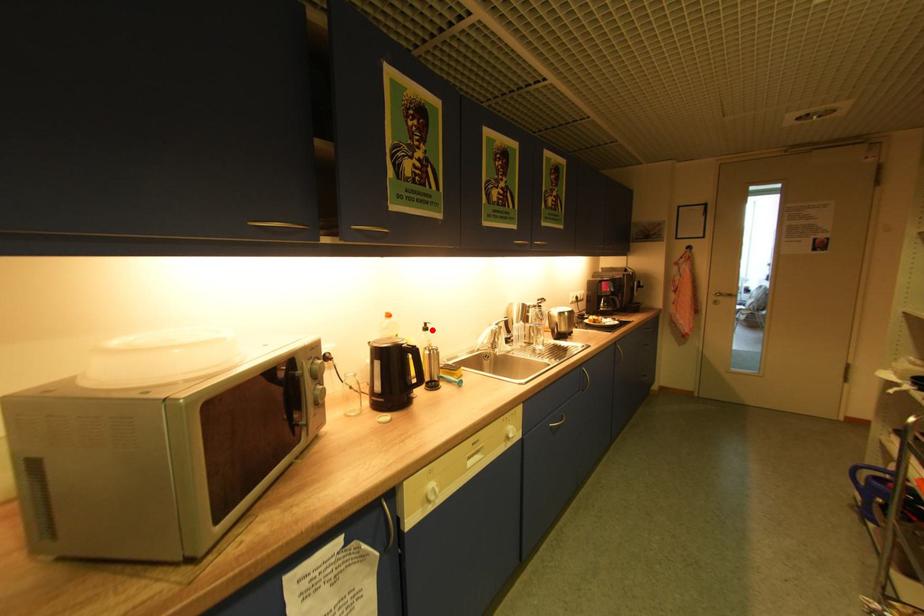
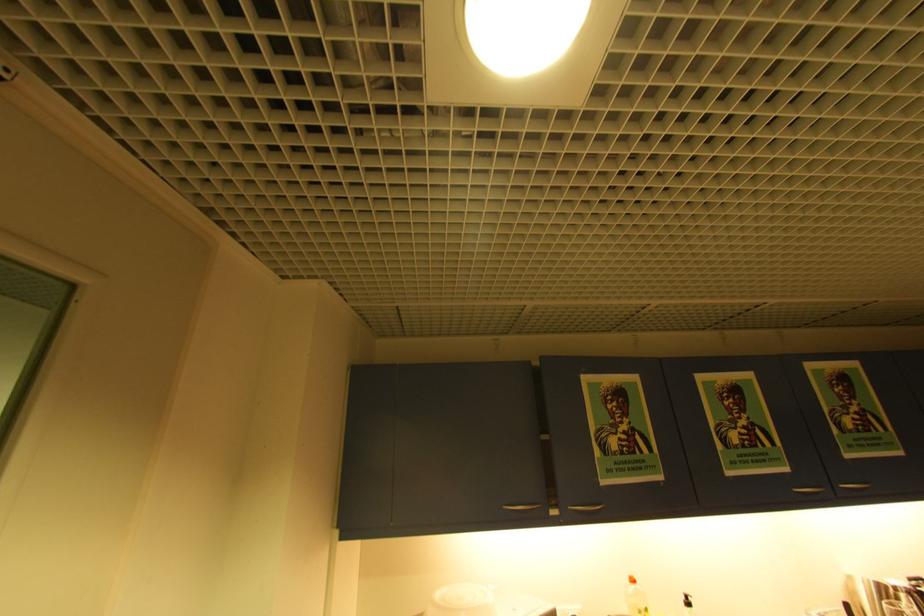
Locate, in the second image, the point that corresponds to the highlighted location in the first image.

(695, 605)